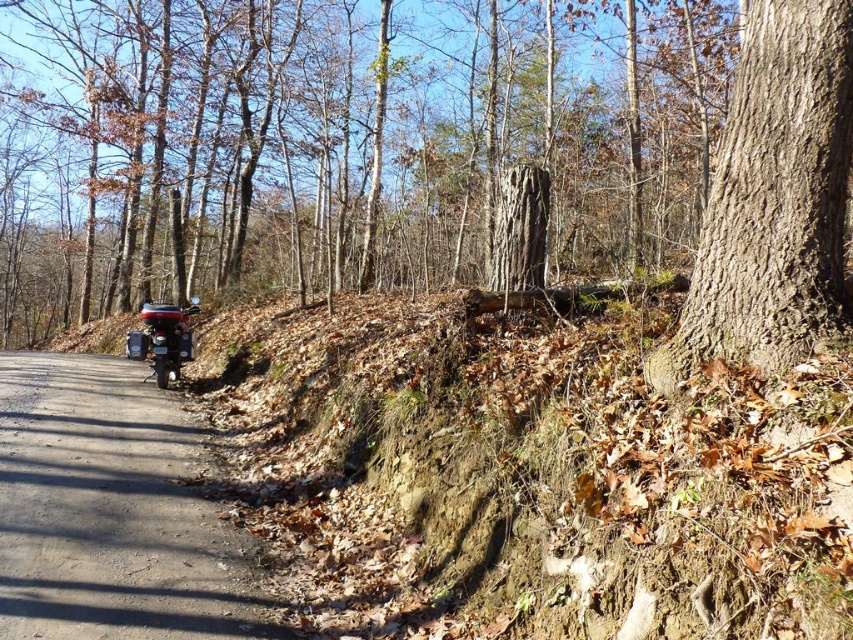
Question: Is black asphalt road at center thinner than brown rough bark tree at right?

Choices:
 (A) yes
 (B) no

Answer: (B)

Question: Estimate the real-world distances between objects in this image. Which object is closer to the shiny metallic motorbike at lower left?

Choices:
 (A) black asphalt road at center
 (B) brown rough tree trunk at center right

Answer: (A)

Question: Among these objects, which one is nearest to the camera?

Choices:
 (A) shiny metallic motorbike at lower left
 (B) black asphalt road at center
 (C) brown rough tree trunk at center right

Answer: (B)

Question: Can you confirm if black asphalt road at center is positioned to the right of brown rough bark tree at right?

Choices:
 (A) no
 (B) yes

Answer: (A)

Question: Estimate the real-world distances between objects in this image. Which object is farther from the black asphalt road at center?

Choices:
 (A) shiny metallic motorbike at lower left
 (B) brown rough bark tree at right

Answer: (B)

Question: Is the position of brown rough tree trunk at center right less distant than that of brown rough bark tree at right?

Choices:
 (A) no
 (B) yes

Answer: (A)